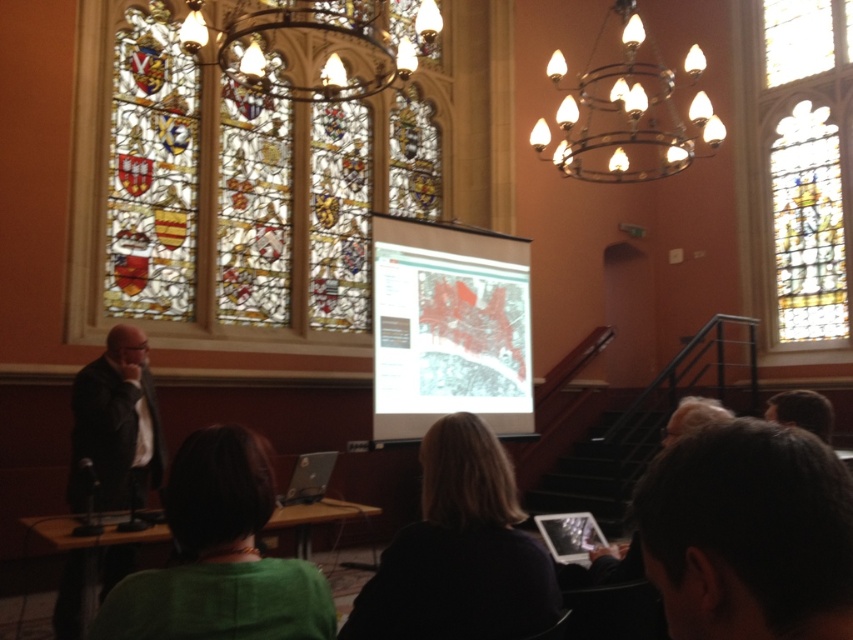
Question: Which of these objects is positioned farthest from the matte plastic projector screen at center?

Choices:
 (A) dark brown leather jacket at left
 (B) green fabric at lower center
 (C) gold metallic chandelier at upper center
 (D) stained glass window at upper right

Answer: (D)

Question: Which of the following is the closest to the observer?

Choices:
 (A) (712, 433)
 (B) (412, 196)

Answer: (A)

Question: Which object appears farthest from the camera in this image?

Choices:
 (A) stained glass at upper left
 (B) stained glass window at upper right
 (C) metallic wire chandelier at upper center
 (D) gold metallic chandelier at upper center

Answer: (B)

Question: Is stained glass at upper left bigger than dark brown hair at lower right?

Choices:
 (A) no
 (B) yes

Answer: (B)

Question: Does dark brown hair at lower right have a greater width compared to matte plastic projector screen at center?

Choices:
 (A) yes
 (B) no

Answer: (A)

Question: Does stained glass at upper left have a greater width compared to gold metallic chandelier at upper center?

Choices:
 (A) no
 (B) yes

Answer: (B)